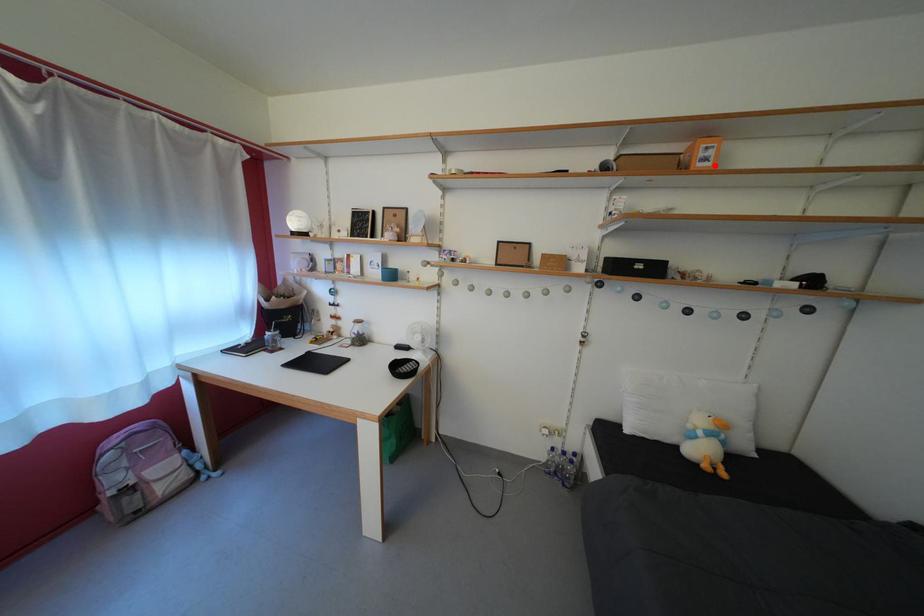
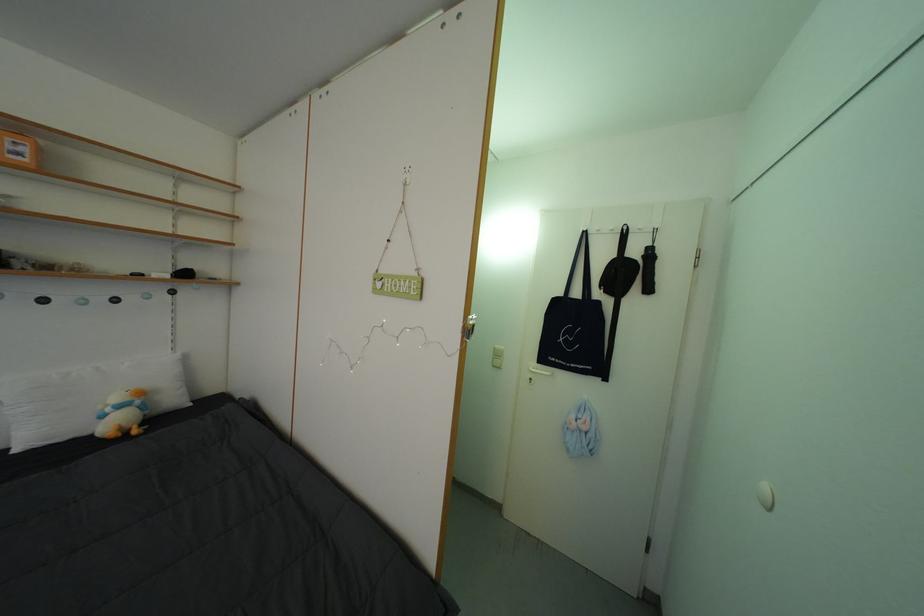
Find the pixel in the second image that matches the highlighted location in the first image.

(27, 160)